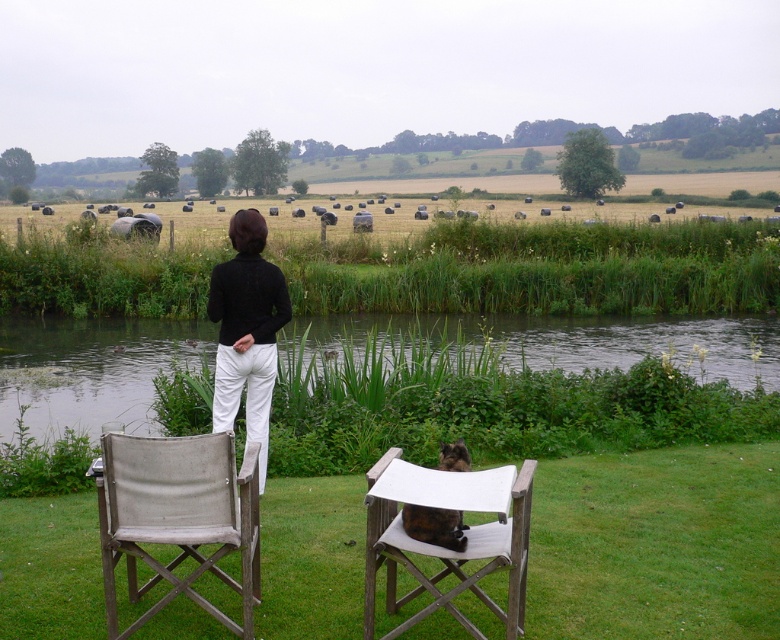
You are planning to set up a small picnic area near the clear water at center and the gray fabric chair at lower left. Since you want to ensure the picnic setup is safe and accessible, which object should you place closer to the water for easy access while keeping the other near the shore?

The gray fabric chair at lower left should be placed closer to the clear water at center because the clear water at center is located above the gray fabric chair at lower left, indicating it is positioned higher and possibly closer to the shore where the picnic setup would be more accessible.